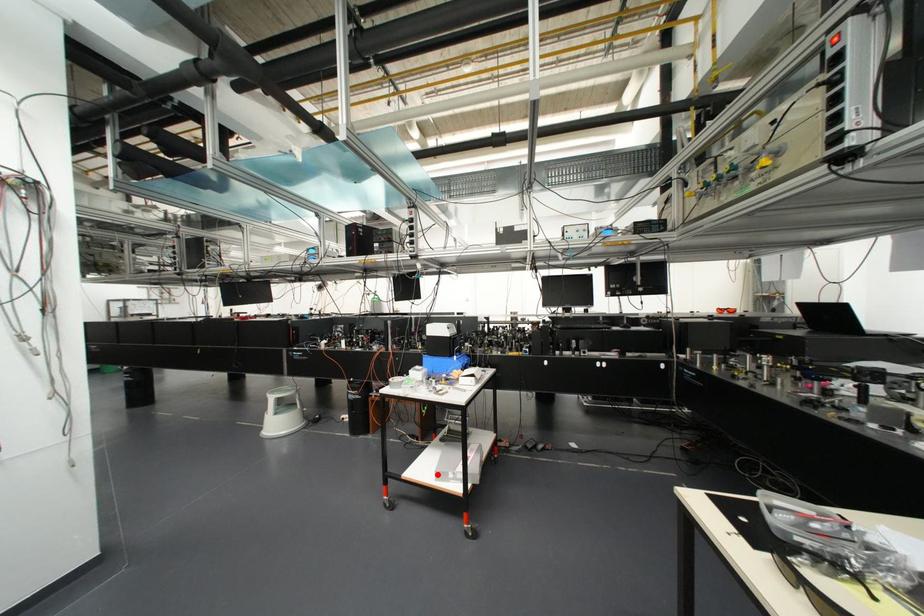
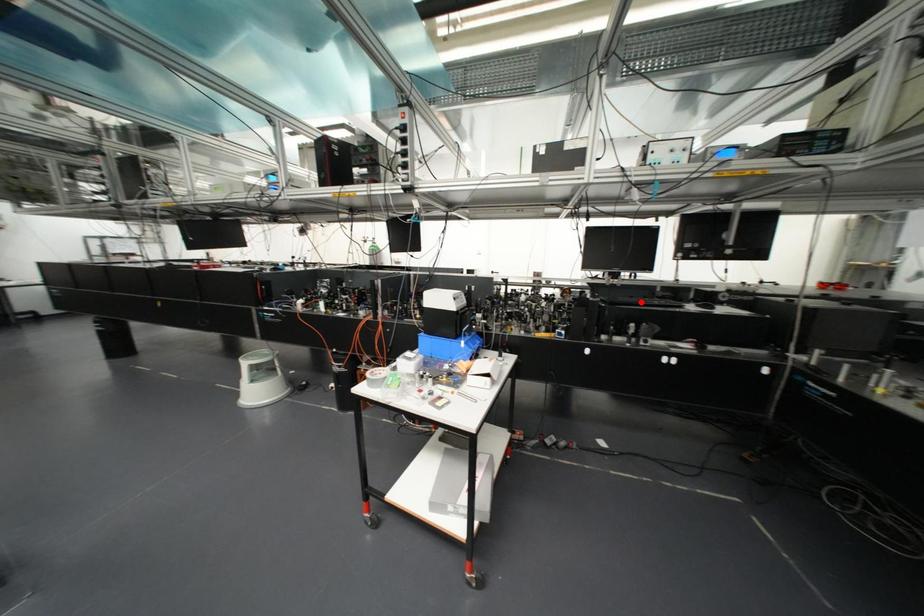
I am providing you with two images of the same scene from different viewpoints. A red point is marked on the first image and another point is marked on the second image. Does the point marked in image1 correspond to the same location as the one in image2?

No